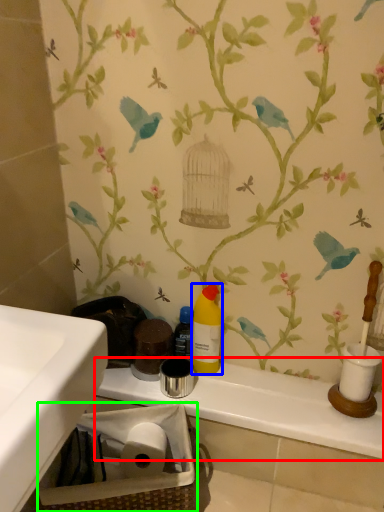
Question: Which object is positioned farthest from counter top (highlighted by a red box)? Select from cleaning product (highlighted by a blue box) and basket (highlighted by a green box).

Choices:
 (A) cleaning product
 (B) basket

Answer: (A)